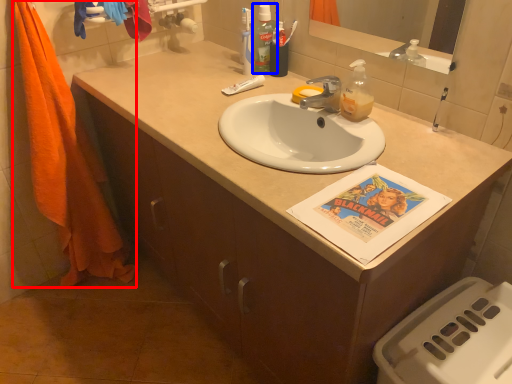
Question: Among these objects, which one is nearest to the camera, beach towel (highlighted by a red box) or mouthwash (highlighted by a blue box)?

Choices:
 (A) beach towel
 (B) mouthwash

Answer: (A)